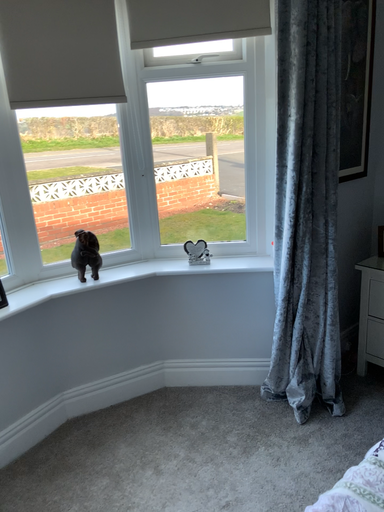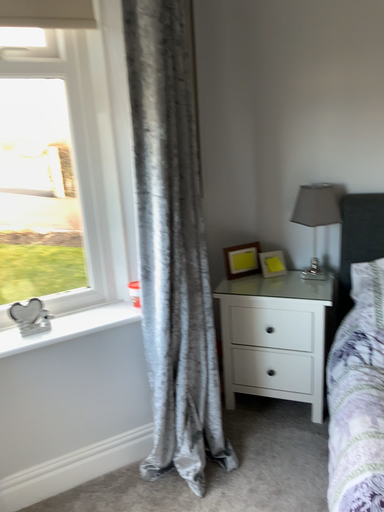
Question: How did the camera likely rotate when shooting the video?

Choices:
 (A) rotated right
 (B) rotated left

Answer: (A)